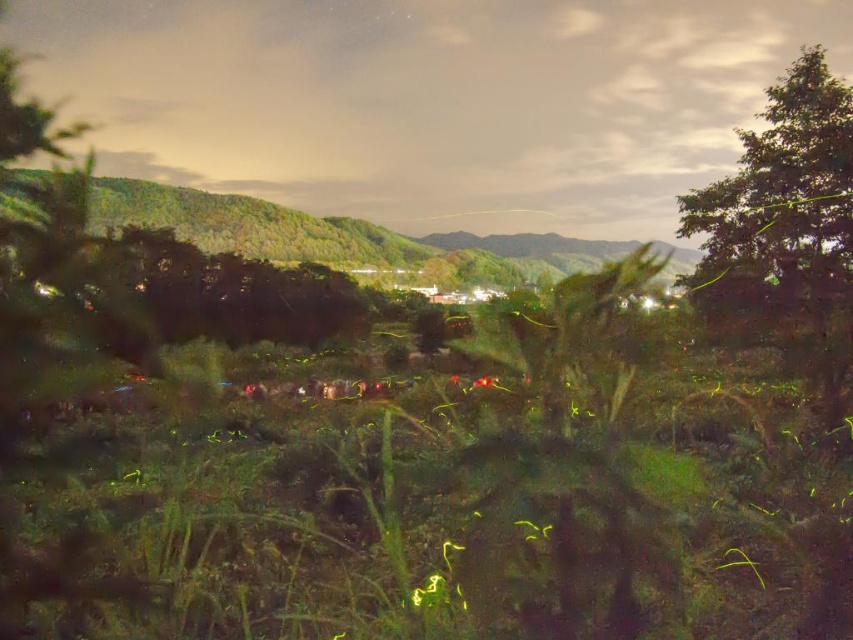
Does green grass at center have a lesser height compared to green leafy hillside at upper left?

No, green grass at center is not shorter than green leafy hillside at upper left.

Looking at this image, does green grass at center appear on the right side of green leafy hillside at upper left?

Yes, green grass at center is to the right of green leafy hillside at upper left.

What do you see at coordinates (426, 99) in the screenshot?
I see `green grass at center` at bounding box center [426, 99].

Locate an element on the screen. The height and width of the screenshot is (640, 853). green grass at center is located at coordinates (426, 99).

Does green grass at center appear under green leafy tree at upper right?

Actually, green grass at center is above green leafy tree at upper right.

Is point (347, 99) more distant than point (813, 76)?

Yes, it is.

Identify the location of green grass at center. This screenshot has height=640, width=853. (426, 99).

Can you confirm if green leafy tree at upper right is shorter than green leafy hillside at upper left?

Yes.

Can you confirm if green leafy tree at upper right is taller than green leafy hillside at upper left?

Incorrect, green leafy tree at upper right's height is not larger of green leafy hillside at upper left's.

Find the location of `green leafy tree at upper right`. green leafy tree at upper right is located at coordinates (781, 205).

I want to click on green leafy tree at upper right, so click(x=781, y=205).